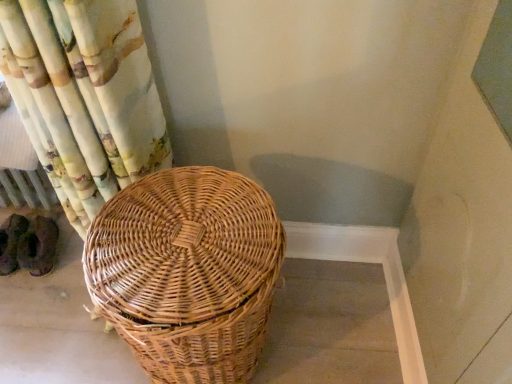
Locate an element on the screen. This screenshot has height=384, width=512. free point above woven brown picnic basket at center (from a real-world perspective) is located at coordinates (178, 228).